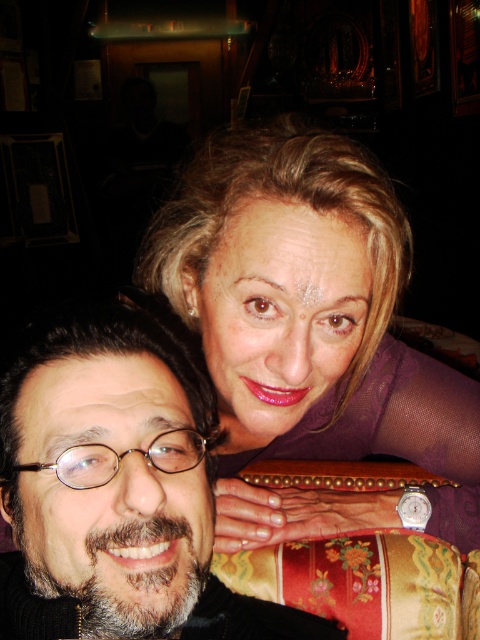
Who is more distant from viewer, (211, 291) or (12, 445)?

The point (211, 291) is more distant.

Is matte purple blouse at upper right to the right of smooth black hair at center from the viewer's perspective?

Indeed, matte purple blouse at upper right is positioned on the right side of smooth black hair at center.

Who is more forward, (310, 394) or (44, 509)?

Point (44, 509) is more forward.

Locate an element on the screen. matte purple blouse at upper right is located at coordinates (310, 310).